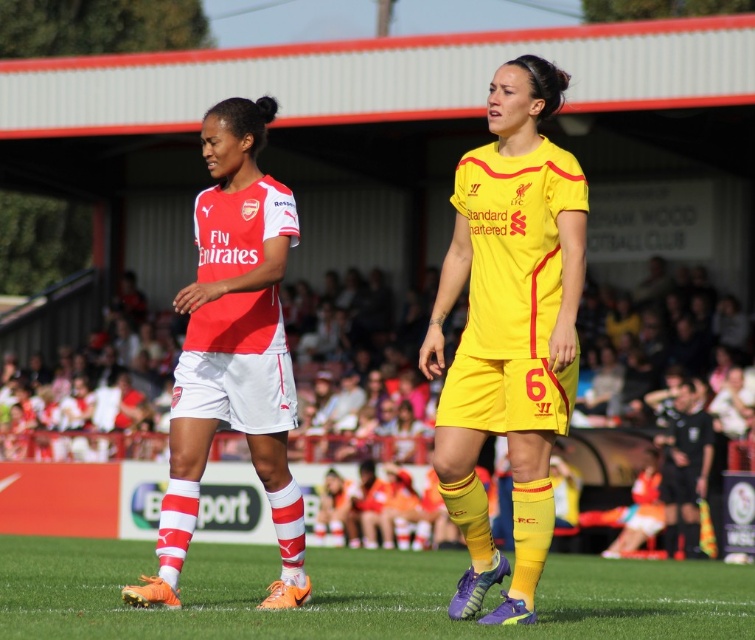
Question: Can you confirm if green grass at center is wider than matte red and white jersey at center?

Choices:
 (A) yes
 (B) no

Answer: (A)

Question: Estimate the real-world distances between objects in this image. Which object is closer to the matte red and white jersey at center?

Choices:
 (A) yellow matte jersey at center
 (B) green grass at center

Answer: (A)

Question: Which of the following is the farthest from the observer?

Choices:
 (A) matte red and white jersey at center
 (B) green grass at center

Answer: (A)

Question: Based on their relative distances, which object is farther from the matte red and white jersey at center?

Choices:
 (A) green grass at center
 (B) yellow matte jersey at center

Answer: (A)

Question: Considering the relative positions of yellow matte jersey at center and green grass at center in the image provided, where is yellow matte jersey at center located with respect to green grass at center?

Choices:
 (A) below
 (B) above

Answer: (B)

Question: Can you confirm if green grass at center is positioned to the right of matte red and white jersey at center?

Choices:
 (A) yes
 (B) no

Answer: (A)